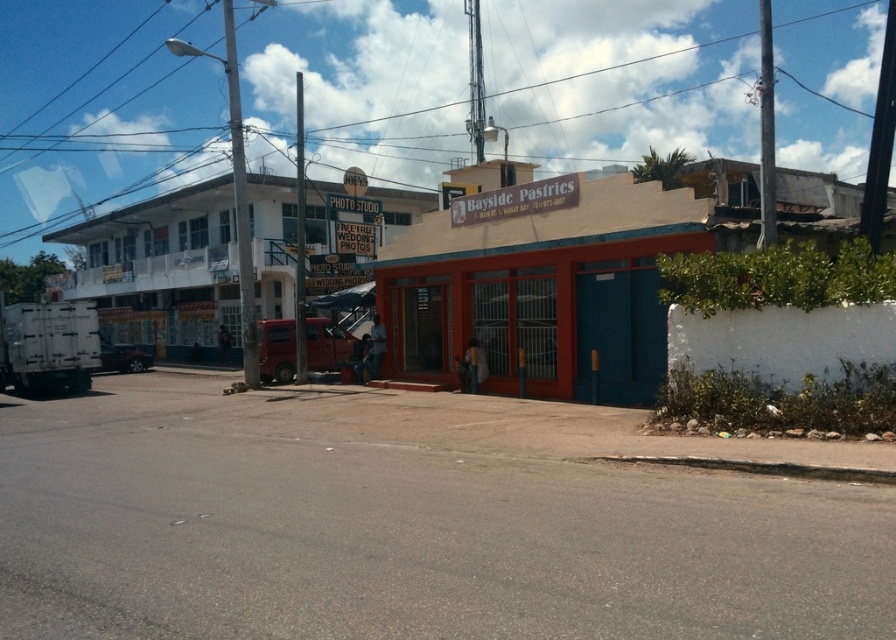
You are standing on the street and see two points marked in the image. Which point is closer to you, point (182, 320) or point (211, 237)?

Point (182, 320) is closer to you because it is further to the viewer than point (211, 237).

You are standing at the intersection and need to determine which building is taller between the white matte building at center and the matte orange storefront at center. Based on the scene, which one is taller?

The white matte building at center is taller than the matte orange storefront at center.

You are a delivery person trying to find Bayside Pastries. You see the matte orange storefront at center and the white matte building at upper left. According to the scene, which one is closer to the road where you are standing?

The matte orange storefront at center is closer to the road where you are standing because it is located below the white matte building at upper left, indicating it is positioned lower in the scene and thus nearer to the foreground road.